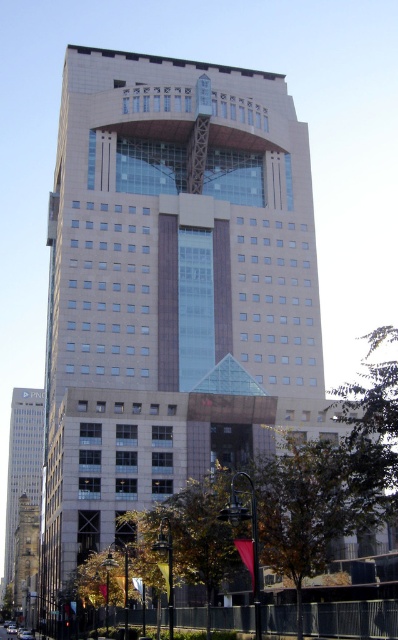
You are standing in front of the modern highrise building and see the stone tower at left and the silver metallic car at center. Which object is positioned to the left of the other?

The stone tower at left is positioned to the left of the silver metallic car at center.

You are standing at the entrance of the modern highrise building and want to locate the matte glass tower at left. According to the building layout, where should you look to find it?

The matte glass tower at left is located at point (23, 461), so you should look to the lower left area of the building.